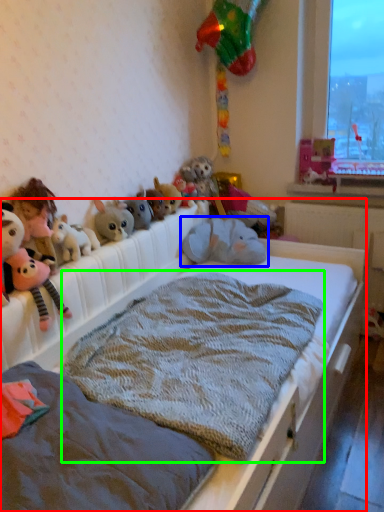
Question: Which object is the closest to the bed (highlighted by a red box)? Choose among these: toy (highlighted by a blue box) or blanket (highlighted by a green box).

Choices:
 (A) toy
 (B) blanket

Answer: (B)